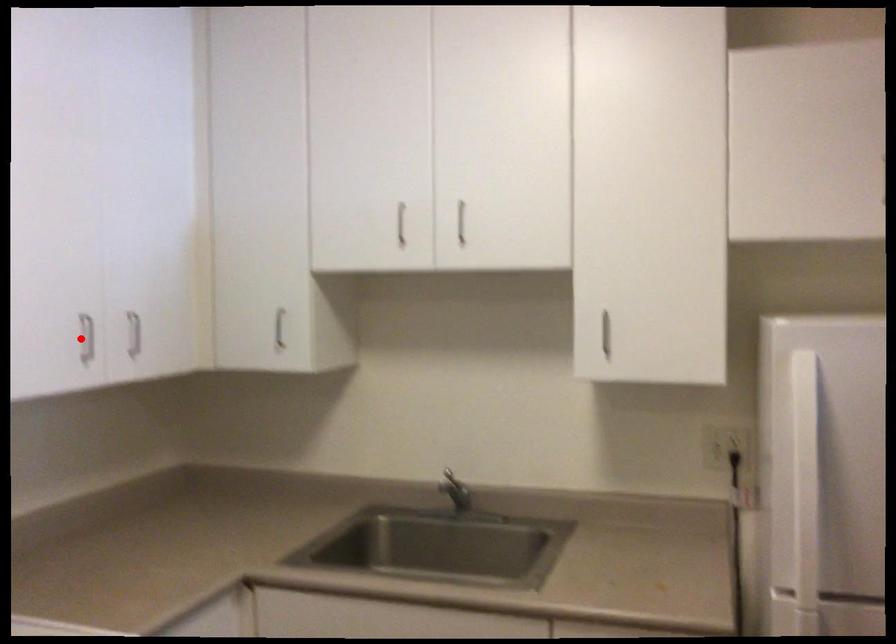
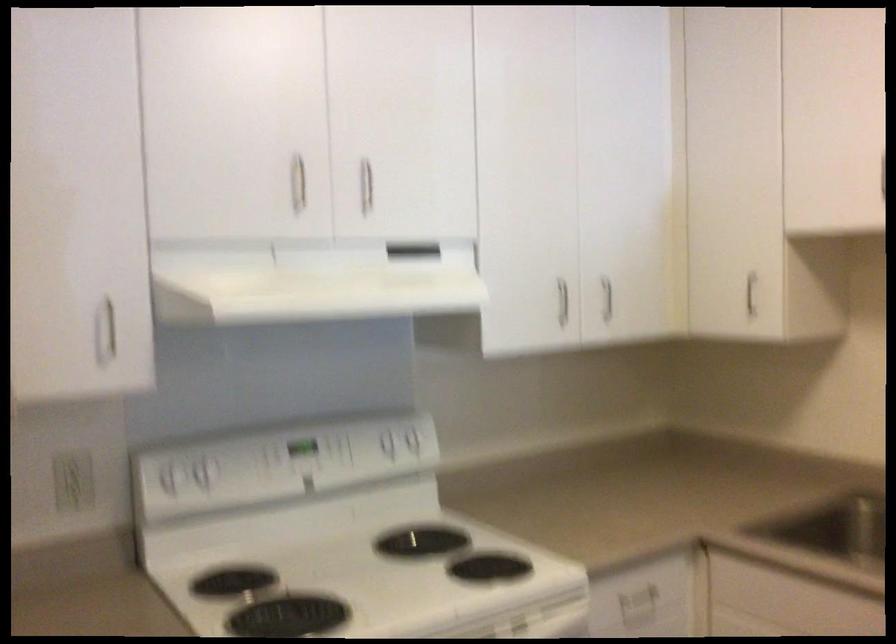
The point at the highlighted location is marked in the first image. Where is the corresponding point in the second image?

(562, 301)